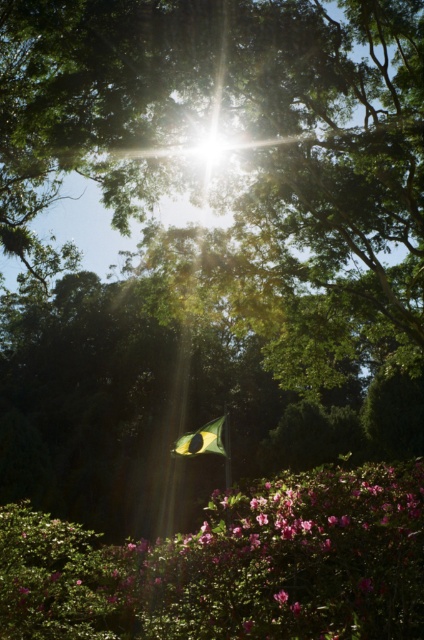
Consider the image. Between yellow-green fabric flag at center and pink matte flower at center, which one is positioned higher?

pink matte flower at center is higher up.

Between yellow-green fabric flag at center and pink matte flower at center, which one is positioned lower?

yellow-green fabric flag at center is below.

Identify the location of yellow-green fabric flag at center. Image resolution: width=424 pixels, height=640 pixels. pyautogui.click(x=201, y=440).

You are a GUI agent. You are given a task and a screenshot of the screen. Output one action in this format:
    pyautogui.click(x=<x>, y=<y>)
    Task: Click on the yellow-green fabric flag at center
    
    Given the screenshot: What is the action you would take?
    pyautogui.click(x=201, y=440)